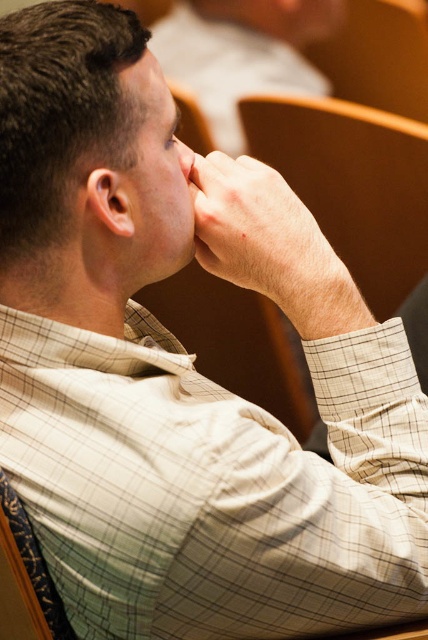
You are a photographer trying to capture a candid shot of the man in the lecture hall. You notice a specific point in the image at coordinates point (267, 241). What is the subject of this point in the image?

The point (267, 241) indicates smooth skin hand at center.

You are a photographer adjusting the camera focus. You need to ensure both the smooth skin hand at center and the smooth skin nose at center are in focus. Since the camera can only focus on one point at a time, which object should you prioritize focusing on to ensure both are sharp?

The smooth skin hand at center is taller than the smooth skin nose at center, so focusing on the smooth skin hand at center will ensure the nose is also in focus due to its closer proximity in depth.

You are a person who is 5 feet tall. You want to sit in the brown wood chair at center. How much space will be between your head and the ceiling if the ceiling is 8 feet high?

The brown wood chair at center has a height of 6.21 feet. Since you are 5 feet tall, the space between your head and the ceiling would be 8 feet minus 5 feet, which equals 3 feet. However, this calculation assumes that the chair height is measured to the seat, but typically chair height refers to the seat height. If the seat is 18 inches high, your head would be around 5.5 feet, leaving 2.5 feet of space. Without exact measurements, it is difficult to determine precisely, but the available space is likely 2